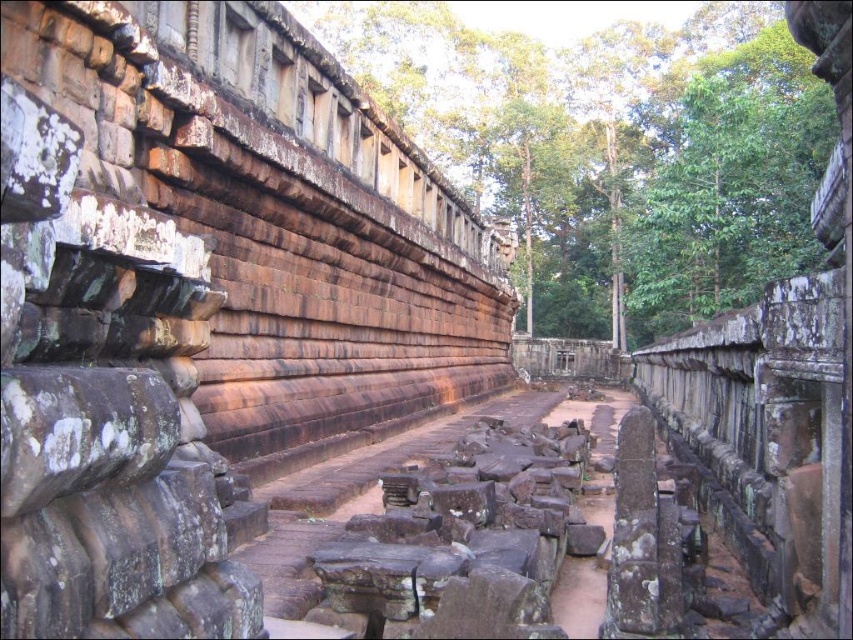
You are an archaeologist examining the ancient stone structure. You notice the weathered stone railing at upper center and the rusty stone steps at center. Which object appears bigger in the image?

The weathered stone railing at upper center is larger in size than the rusty stone steps at center, so it appears bigger in the image.

You are standing on the pathway leading towards the center of the ancient stone structure. You see two points marked on the image, point (660, 356) and point (334, 568). Which point is closer to you as you stand on the pathway?

Point (660, 356) is closer to you because it is further to the viewer than point (334, 568).

You are a preservationist assessing the structural integrity of the ancient stone structure. You notice the weathered stone railing at upper center and the rusty stone steps at center. Which object is higher in elevation from your viewpoint?

The weathered stone railing at upper center is taller than the rusty stone steps at center, so it is higher in elevation from your viewpoint.